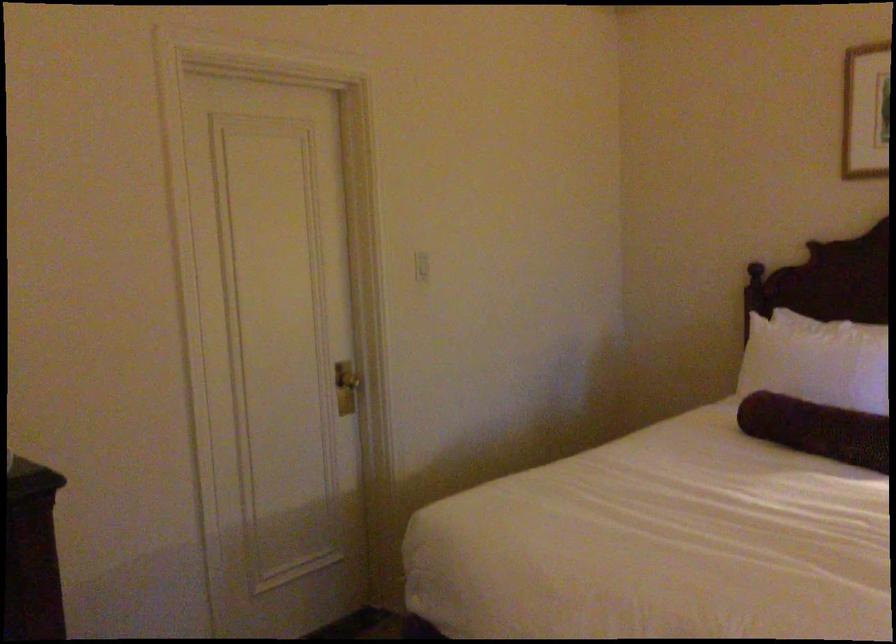
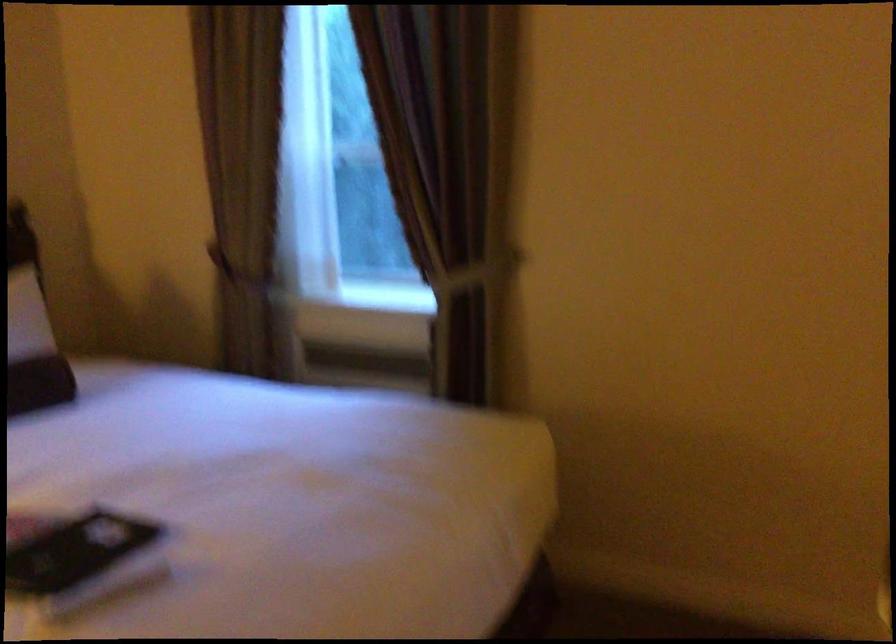
Question: The camera is either moving clockwise (left) or counter-clockwise (right) around the object. The first image is from the beginning of the video and the second image is from the end. Is the camera moving left or right when shooting the video?

Choices:
 (A) Left
 (B) Right

Answer: (A)